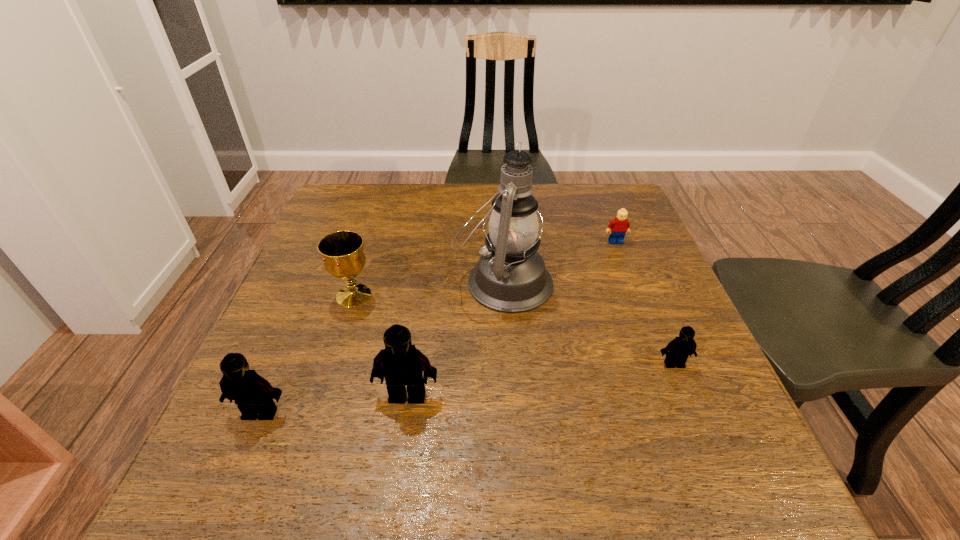
Please determine a free point for an extra Lego to ensure balance. Please provide its 2D coordinates. Your answer should be formatted as a tuple, i.e. [(x, y)], where the tuple contains the x and y coordinates of a point satisfying the conditions above.

[(545, 379)]